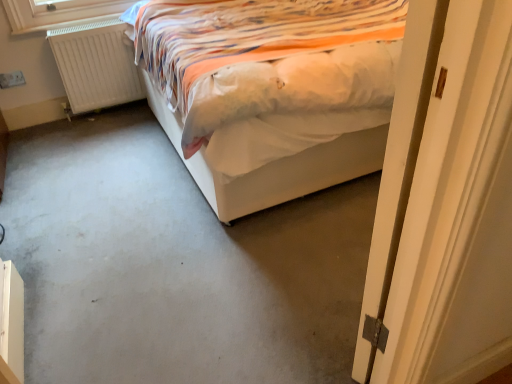
You are a GUI agent. You are given a task and a screenshot of the screen. Output one action in this format:
    pyautogui.click(x=<x>, y=<y>)
    Task: Click on the free space to the left of white wooden door at right
    The height and width of the screenshot is (384, 512).
    Given the screenshot: What is the action you would take?
    pyautogui.click(x=269, y=303)